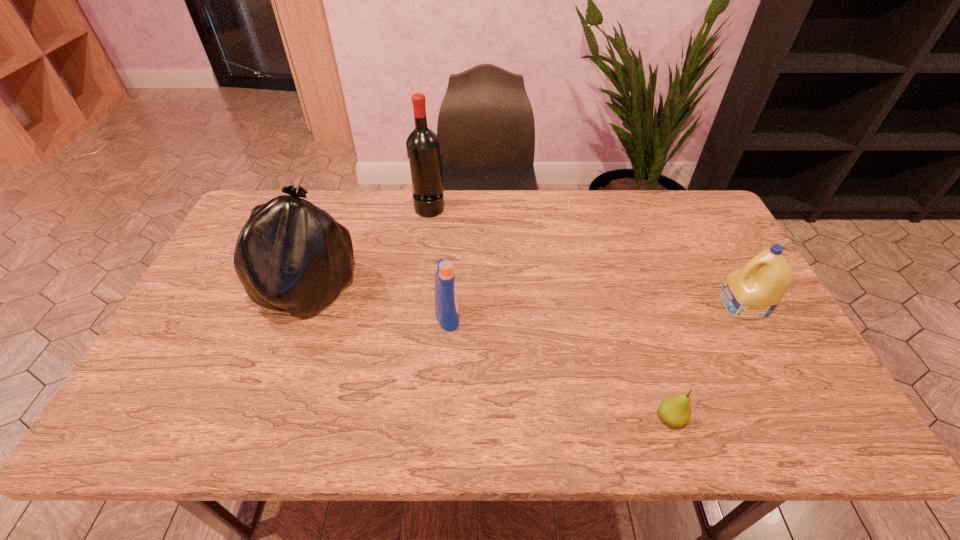
At what (x,y) coordinates should I click in order to perform the action: click on vacant region at the near edge. Please return your answer as a coordinate pair (x, y). Image resolution: width=960 pixels, height=540 pixels. Looking at the image, I should click on (460, 426).

The height and width of the screenshot is (540, 960). In the image, there is a desktop. What are the coordinates of `vacant space at the left edge` in the screenshot? It's located at (202, 360).

This screenshot has height=540, width=960. In order to click on vacant area at the near left corner of the desktop in this screenshot , I will do `click(132, 417)`.

In the image, there is a desktop. Where is `free space at the far right corner`? free space at the far right corner is located at coordinates (679, 220).

Identify the location of vacant area that lies between the right detergent and the left detergent. (595, 310).

The image size is (960, 540). In order to click on free area in between the leftmost object and the pear in this screenshot , I will do `click(489, 356)`.

In order to click on free spot between the plastic bag and the tallest object in this screenshot , I will do `click(368, 250)`.

Identify the location of vacant area that lies between the left detergent and the fourth object from left to right. The width and height of the screenshot is (960, 540). (560, 367).

At what (x,y) coordinates should I click in order to perform the action: click on free space between the rightmost object and the left detergent. Please return your answer as a coordinate pair (x, y). Looking at the image, I should click on (595, 310).

The height and width of the screenshot is (540, 960). Find the location of `vacant area that lies between the fourth shortest object and the right detergent`. vacant area that lies between the fourth shortest object and the right detergent is located at coordinates (524, 299).